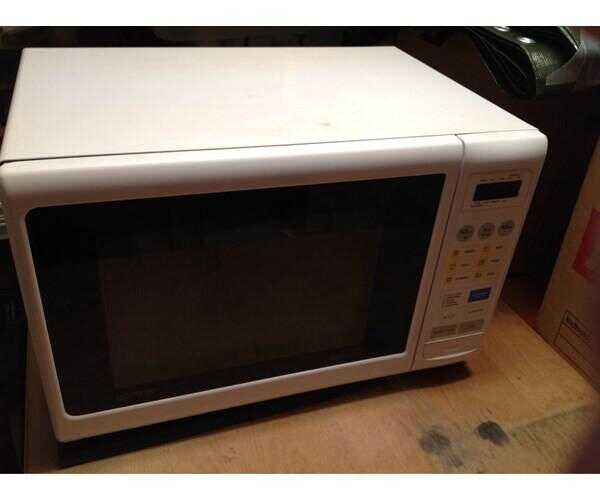
Locate an element on the screen. This screenshot has width=600, height=500. 1 blue button on microwave is located at coordinates (474, 297).